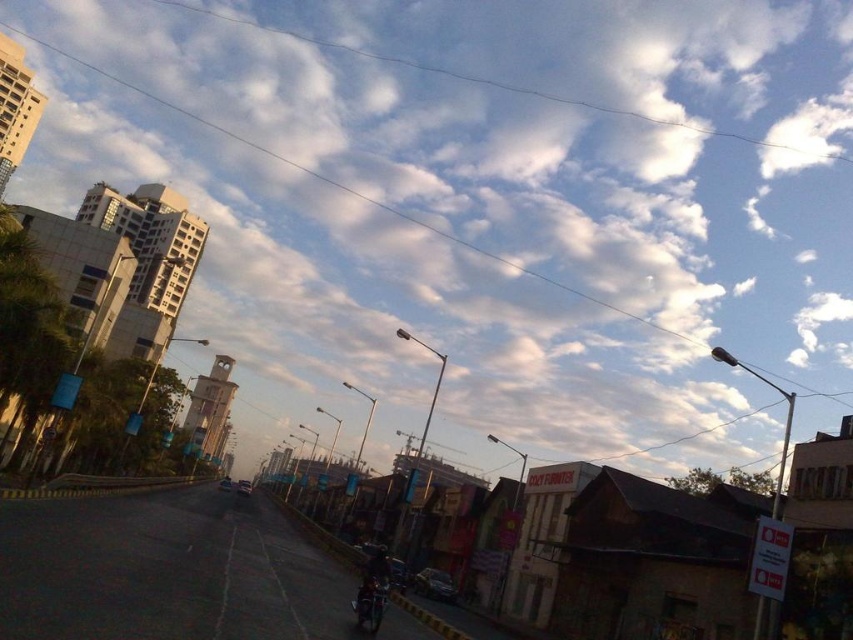
You are standing at the point labeled point (506, 13) and want to walk towards the point labeled point (381, 602). Will you be moving towards the background of the image or towards the foreground?

Since point (506, 13) is further to the camera than point (381, 602), moving from point (506, 13) to point (381, 602) means you are moving towards the background of the image.

You are a drone operator trying to capture a photo of the shiny metallic motorcycle at center. However, there is a white fluffy cloud at upper center that might block the view. Based on the scene description, will the cloud obstruct the motorcycle in your photo?

The white fluffy cloud at upper center is above the shiny metallic motorcycle at center, so it will block the motorcycle in the photo.

You are a drone operator trying to capture a photo of the shiny metallic motorcycle at center. You notice the white fluffy cloud at upper center might block the motorcycle in your shot. Based on their positions, will the cloud block the motorcycle?

The white fluffy cloud at upper center is further to the viewer than the shiny metallic motorcycle at center, so the cloud is closer to the camera and will block the motorcycle in the photo.